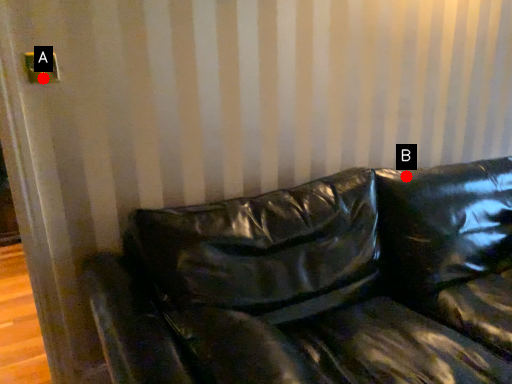
Question: Two points are circled on the image, labeled by A and B beside each circle. Which point is farther from the camera taking this photo?

Choices:
 (A) A is further
 (B) B is further

Answer: (B)